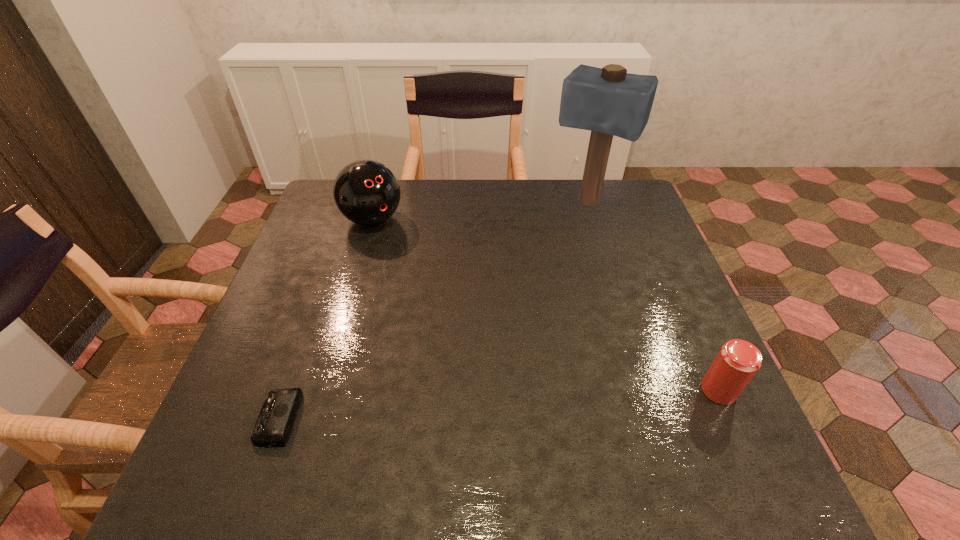
Where is `object that ranks as the second closest to the third tallest object`? object that ranks as the second closest to the third tallest object is located at coordinates (275, 421).

Locate an element on the screen. Image resolution: width=960 pixels, height=540 pixels. free space that satisfies the following two spatial constraints: 1. on the front side of the second shortest object; 2. on the left side of the tallest object is located at coordinates (645, 390).

The width and height of the screenshot is (960, 540). What are the coordinates of `blank area in the image that satisfies the following two spatial constraints: 1. on the front side of the bowling ball; 2. on the left side of the second shortest object` in the screenshot? It's located at (323, 390).